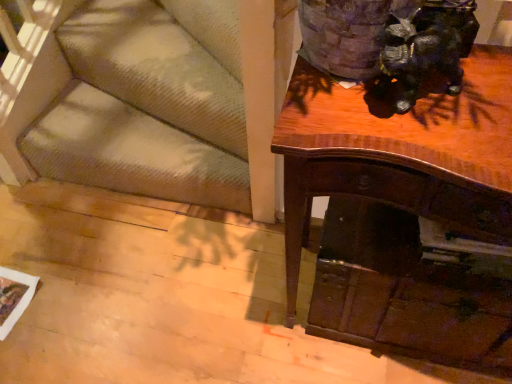
Image resolution: width=512 pixels, height=384 pixels. I want to click on vacant area that is in front of shiny black statue at upper right, so click(x=440, y=144).